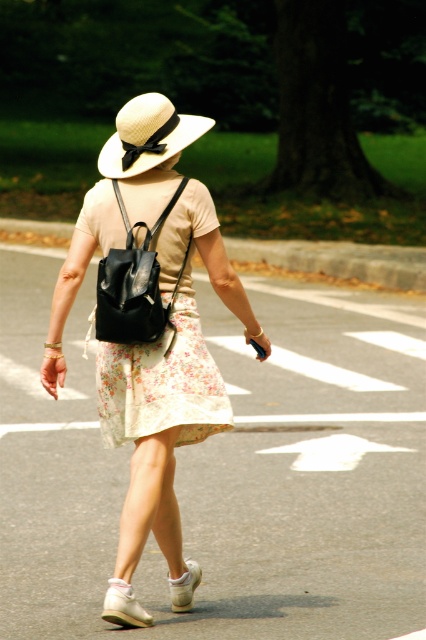
Can you confirm if floral cotton dress at center is positioned below white suede sneaker at lower center?

Incorrect, floral cotton dress at center is not positioned below white suede sneaker at lower center.

Is floral cotton dress at center above white suede sneaker at lower center?

Yes, floral cotton dress at center is above white suede sneaker at lower center.

Who is more distant from viewer, (104, 342) or (181, 593)?

The point (104, 342) is behind.

Where is `floral cotton dress at center`? The width and height of the screenshot is (426, 640). floral cotton dress at center is located at coordinates (163, 381).

Who is more distant from viewer, (178, 131) or (129, 582)?

The point (178, 131) is behind.

Does point (100, 156) come farther from viewer compared to point (114, 605)?

Yes, point (100, 156) is farther from viewer.

Which is behind, point (154, 132) or point (126, 625)?

The point (154, 132) is more distant.

Locate an element on the screen. The image size is (426, 640). natural straw hat at upper center is located at coordinates (147, 134).

Between matte black backpack at center and white fabric sandal at lower center, which one appears on the right side from the viewer's perspective?

Positioned to the right is matte black backpack at center.

Is matte black backpack at center taller than white fabric sandal at lower center?

Indeed, matte black backpack at center has a greater height compared to white fabric sandal at lower center.

Is point (51, 317) positioned in front of point (141, 616)?

That is False.

The image size is (426, 640). Identify the location of matte black backpack at center. (x=150, y=314).